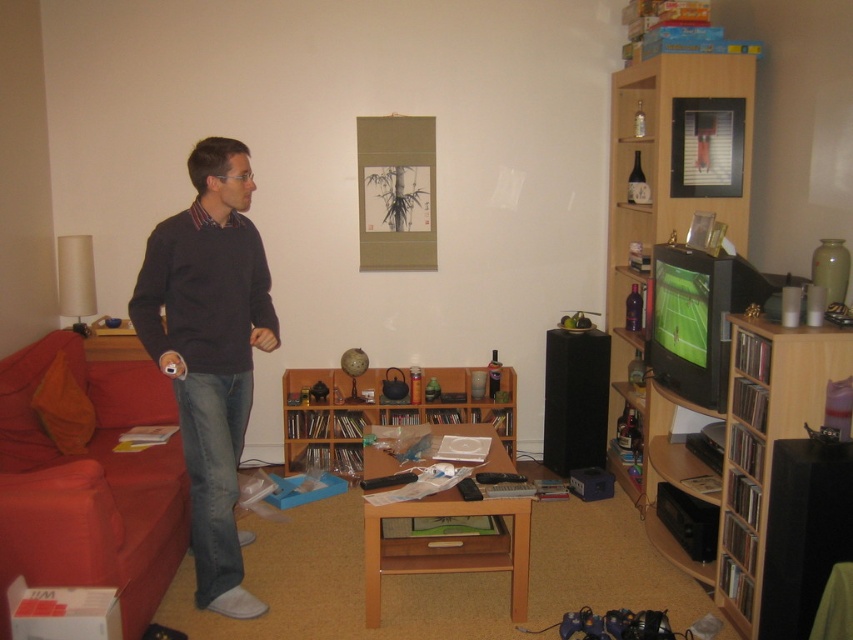
You are standing in the living room and want to place a new plant pot between the red fabric couch at left and the wooden bookshelf at center. Based on their positions, which object should the plant pot be closer to?

The plant pot should be placed closer to the wooden bookshelf at center because the red fabric couch at left is closer to the viewer, meaning the bookshelf is farther back, so placing the plant pot closer to the bookshelf would maintain equal distance between both objects.

You are standing in the living room and want to place a new lamp between the red fabric couch at left and the wooden bookshelf at right. Based on their positions, which object should the lamp be closer to?

The red fabric couch at left is closer to the viewer than the wooden bookshelf at right, so the lamp should be placed closer to the wooden bookshelf at right to maintain symmetry.

You are a guest entering the living room and want to sit down. Which object, the red fabric couch at left or the wooden bookshelf at right, would be more suitable for seating?

The red fabric couch at left is more suitable for seating because it is larger in size than the wooden bookshelf at right, which is not designed for sitting.